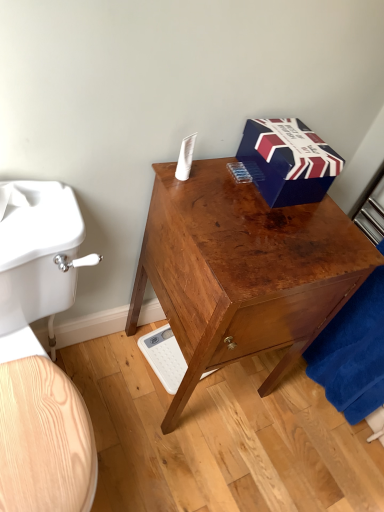
The image size is (384, 512). I want to click on free spot to the right of shiny brown wooden desk at center, so pyautogui.click(x=296, y=434).